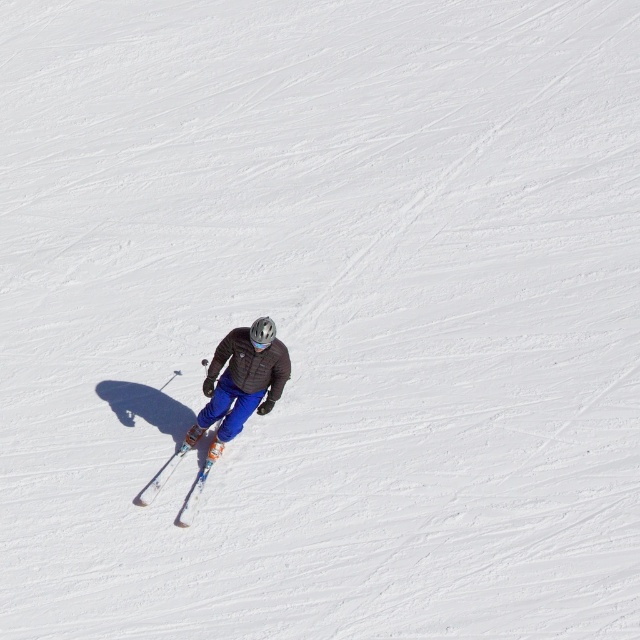
Question: Is matte blue ski pants at center closer to the viewer compared to white plastic ski at center?

Choices:
 (A) no
 (B) yes

Answer: (B)

Question: Can you confirm if matte blue ski pants at center is smaller than white plastic ski at center?

Choices:
 (A) yes
 (B) no

Answer: (B)

Question: Does matte blue ski pants at center have a lesser width compared to white plastic ski at center?

Choices:
 (A) no
 (B) yes

Answer: (A)

Question: Among these points, which one is farthest from the camera?

Choices:
 (A) (184, 508)
 (B) (243, 420)

Answer: (A)